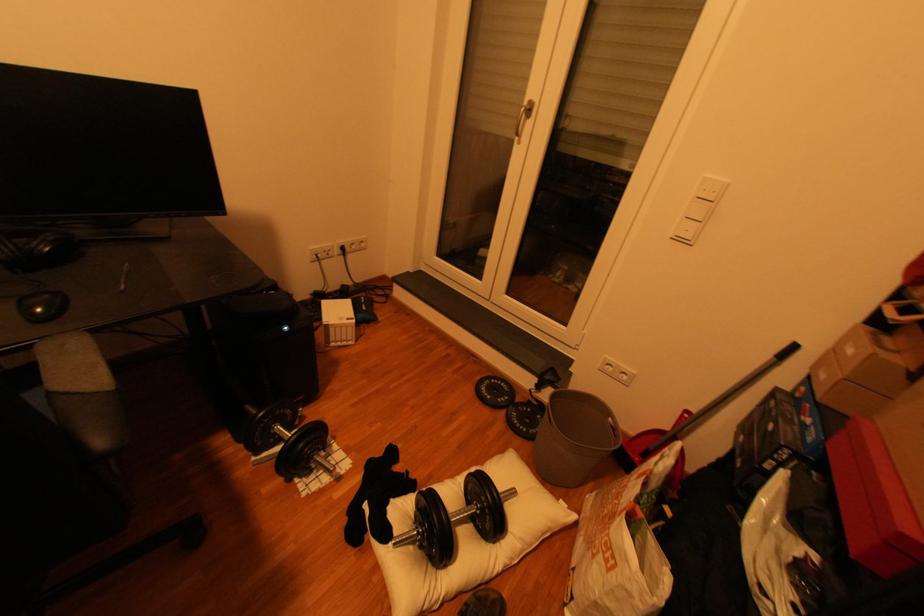
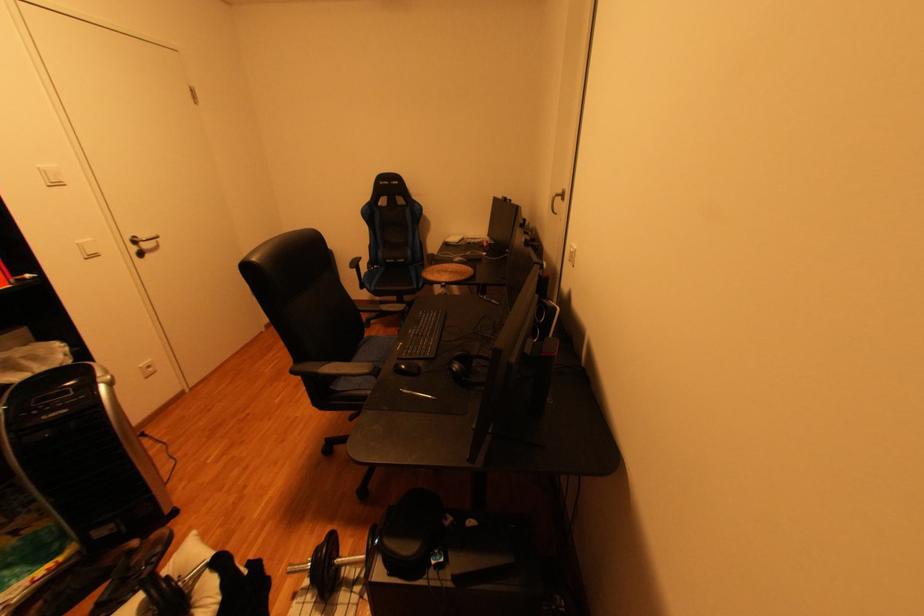
Where in the second image is the point corresponding to point (338, 459) from the first image?

(323, 600)